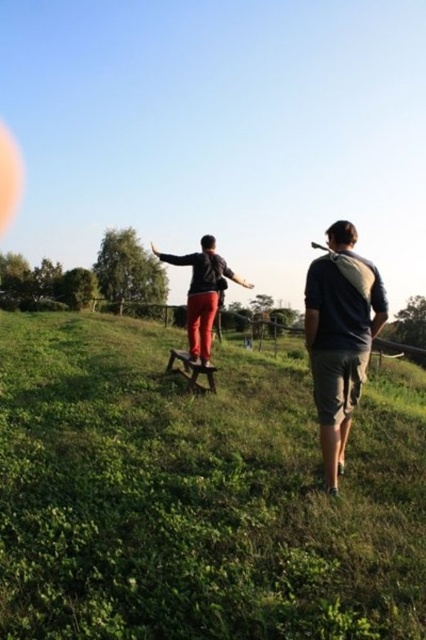
Is green grassy hillside at center thinner than matte black jacket at center?

No, green grassy hillside at center is not thinner than matte black jacket at center.

Between point (109, 342) and point (209, 291), which one is positioned behind?

Positioned behind is point (109, 342).

Which is behind, point (155, 349) or point (201, 259)?

Point (155, 349)

The width and height of the screenshot is (426, 640). Identify the location of green grassy hillside at center. (195, 497).

Who is taller, green grassy hillside at center or dark gray cotton shirt at right?

Standing taller between the two is dark gray cotton shirt at right.

Between point (213, 422) and point (359, 324), which one is positioned in front?

Point (359, 324) is more forward.

You are a GUI agent. You are given a task and a screenshot of the screen. Output one action in this format:
    pyautogui.click(x=<x>, y=<y>)
    Task: Click on the green grassy hillside at center
    The image size is (426, 640).
    Given the screenshot: What is the action you would take?
    pyautogui.click(x=195, y=497)

Which of these two, dark gray cotton shirt at right or matte black jacket at center, stands shorter?

dark gray cotton shirt at right is shorter.

Does dark gray cotton shirt at right have a greater height compared to matte black jacket at center?

No, dark gray cotton shirt at right is not taller than matte black jacket at center.

Is point (344, 228) closer to viewer compared to point (195, 289)?

Yes, point (344, 228) is in front of point (195, 289).

You are a GUI agent. You are given a task and a screenshot of the screen. Output one action in this format:
    pyautogui.click(x=<x>, y=<y>)
    Task: Click on the dark gray cotton shirt at right
    The width and height of the screenshot is (426, 640).
    Given the screenshot: What is the action you would take?
    pyautogui.click(x=339, y=337)